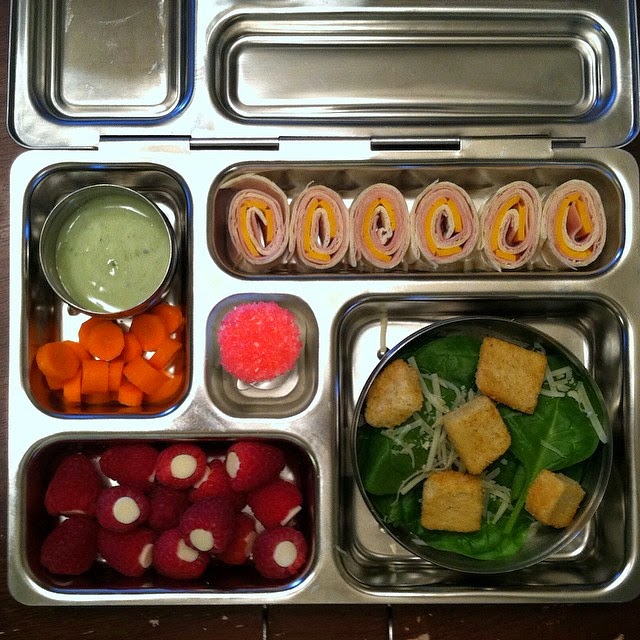
Locate an element on the screen. The height and width of the screenshot is (640, 640). metal tray is located at coordinates (320, 285).